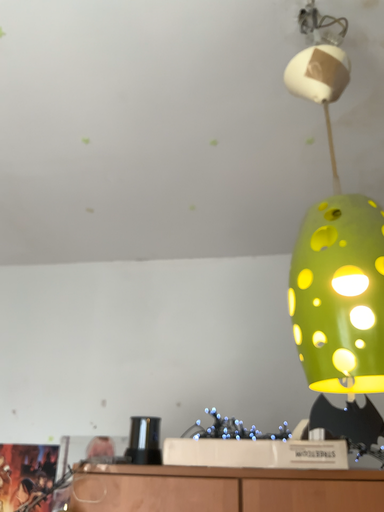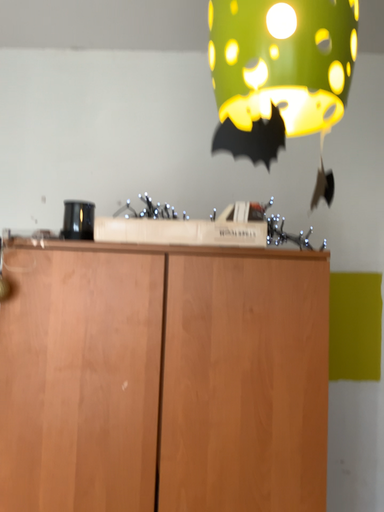
Question: How did the camera likely rotate when shooting the video?

Choices:
 (A) rotated downward
 (B) rotated upward

Answer: (A)